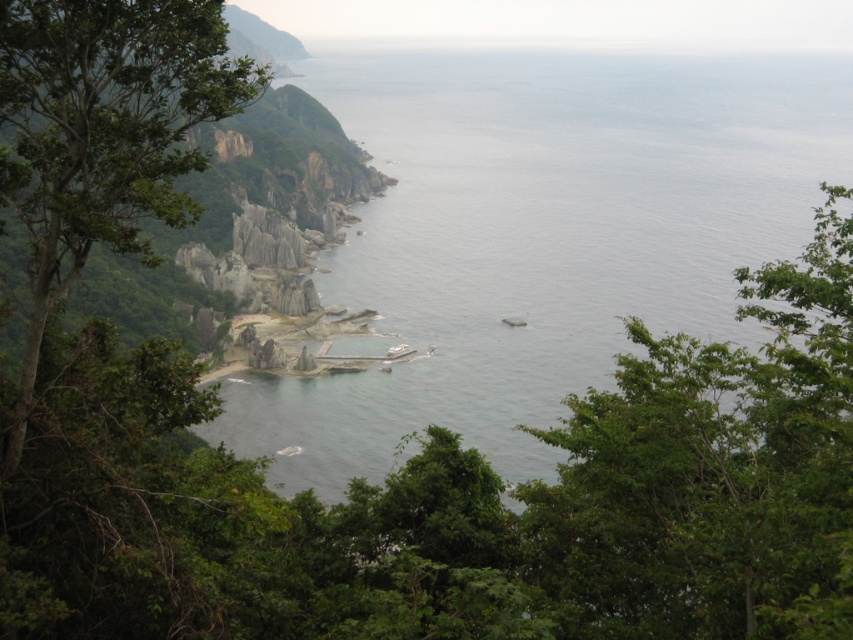
Question: Does clear blue water at center have a larger size compared to green leafy tree at left?

Choices:
 (A) no
 (B) yes

Answer: (B)

Question: Which of the following is the closest to the observer?

Choices:
 (A) (184, 209)
 (B) (78, 396)
 (C) (637, 236)

Answer: (B)

Question: Estimate the real-world distances between objects in this image. Which object is farther from the green leafy tree at center?

Choices:
 (A) clear blue water at center
 (B) green leafy tree at left

Answer: (A)

Question: Which point is closer to the camera?

Choices:
 (A) (177, 525)
 (B) (712, 129)
 (C) (212, 29)

Answer: (C)

Question: Observing the image, what is the correct spatial positioning of green leafy tree at center in reference to green leafy tree at left?

Choices:
 (A) below
 (B) above

Answer: (A)

Question: Does clear blue water at center have a larger size compared to green leafy tree at left?

Choices:
 (A) yes
 (B) no

Answer: (A)